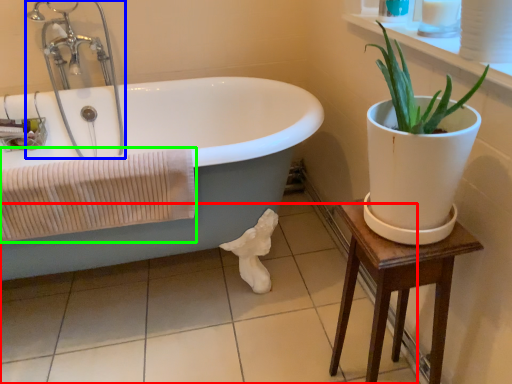
Question: Which is nearer to the tile (highlighted by a red box)? faucet (highlighted by a blue box) or bath towel (highlighted by a green box).

Choices:
 (A) faucet
 (B) bath towel

Answer: (B)